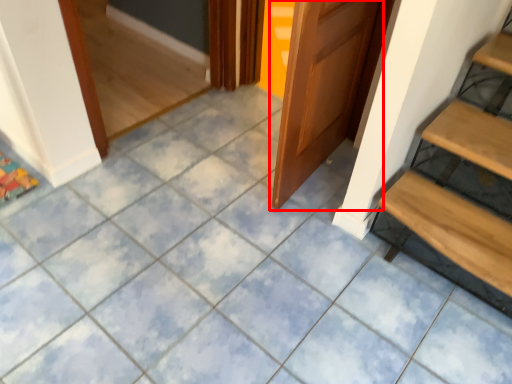
Question: From the image's perspective, what is the correct spatial positioning of door (annotated by the red box) in reference to stairs?

Choices:
 (A) above
 (B) below

Answer: (A)